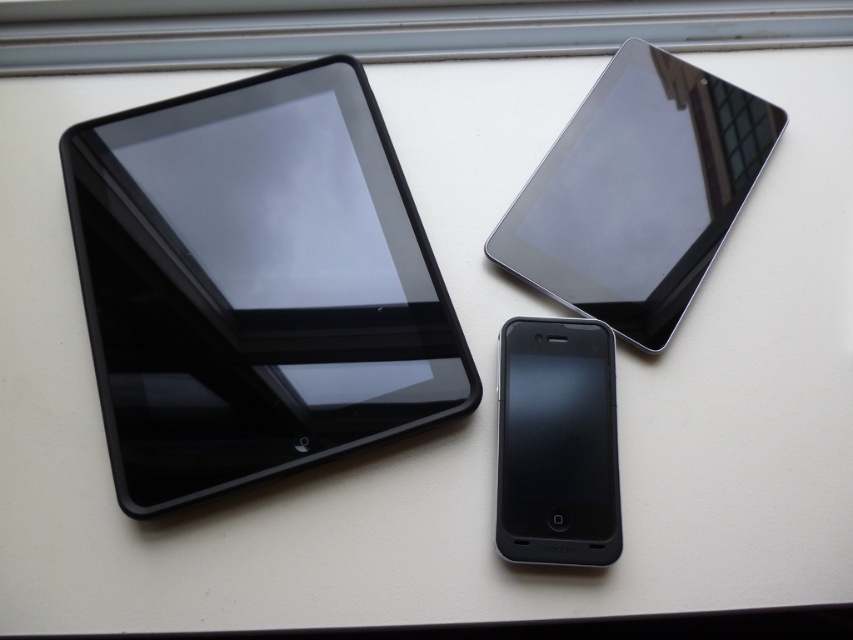
Does glossy black tablet at upper right appear under matte black tablet at center?

No.

Between point (576, 232) and point (514, 515), which one is positioned in front?

Point (514, 515)

Where is `glossy black tablet at upper right`? This screenshot has width=853, height=640. glossy black tablet at upper right is located at coordinates (637, 193).

Who is positioned more to the left, black glossy tablet at left or matte black tablet at center?

Positioned to the left is black glossy tablet at left.

Does black glossy tablet at left have a larger size compared to matte black tablet at center?

Yes, black glossy tablet at left is bigger than matte black tablet at center.

Does point (190, 156) come closer to viewer compared to point (596, 332)?

That is False.

Locate an element on the screen. black glossy tablet at left is located at coordinates (254, 284).

From the picture: Does black glossy tablet at left have a smaller size compared to glossy black tablet at upper right?

No.

Is black glossy tablet at left below glossy black tablet at upper right?

Indeed, black glossy tablet at left is positioned under glossy black tablet at upper right.

Locate an element on the screen. This screenshot has height=640, width=853. black glossy tablet at left is located at coordinates (254, 284).